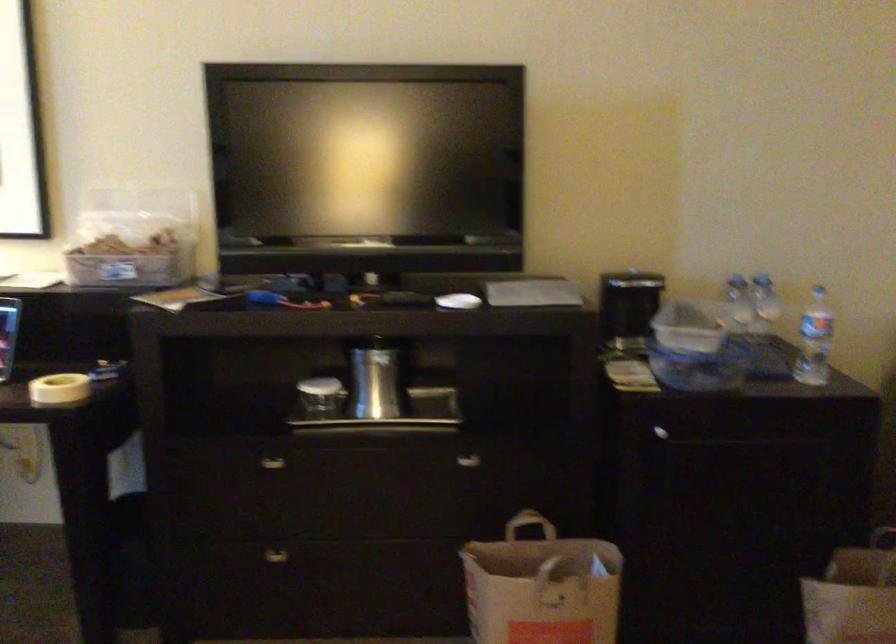
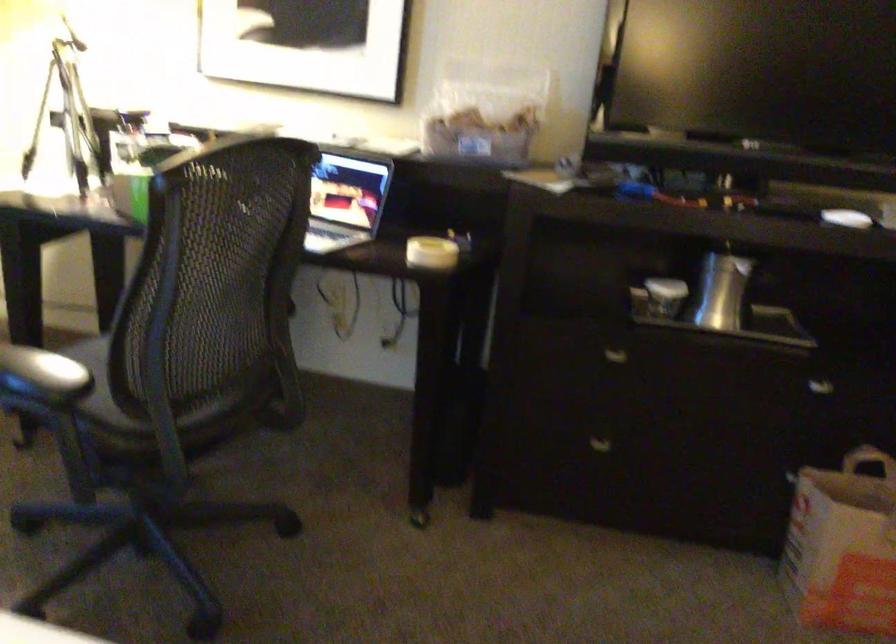
Find the pixel in the second image that matches pixel 373 386 in the first image.

(721, 290)